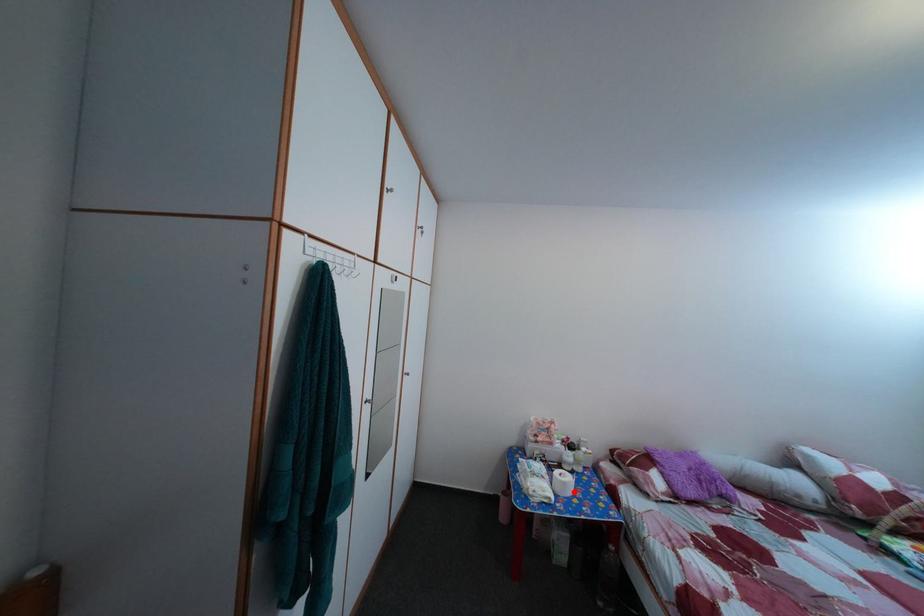
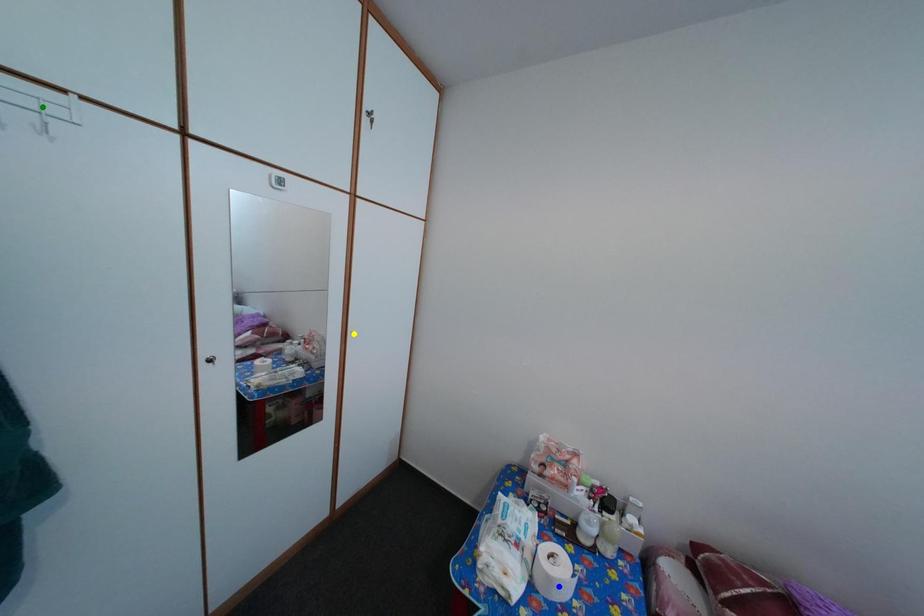
Question: I am providing you with two images of the same scene from different viewpoints. A red point is marked on the first image. You are given multiple points on the second image. Which point in image 2 is actually the same real-world point as the red point in image 1?

Choices:
 (A) blue point
 (B) yellow point
 (C) green point

Answer: (A)